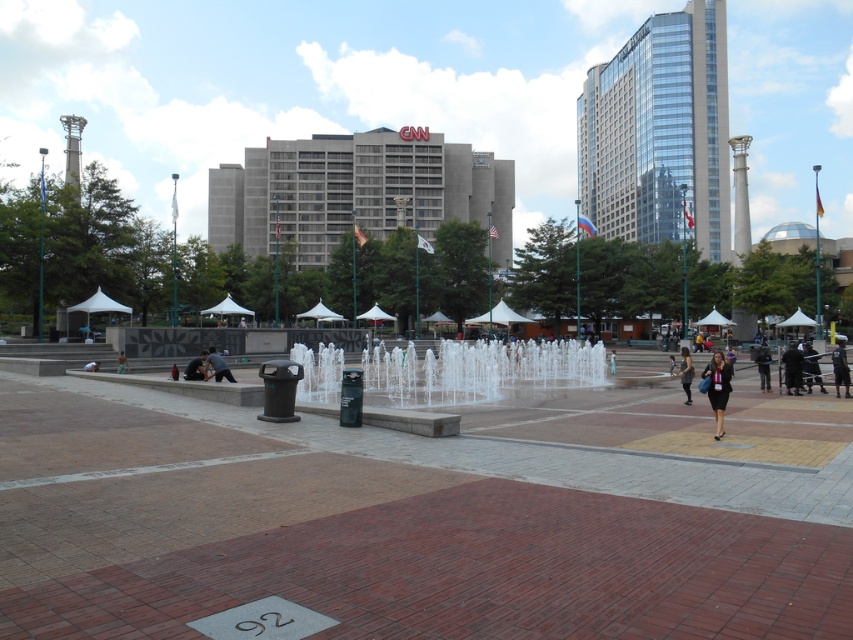
Question: Estimate the real-world distances between objects in this image. Which object is closer to the dark blue jacket at lower right?

Choices:
 (A) dark hair person at center
 (B) dark blue uniform at center
 (C) dark gray jacket at center

Answer: (B)

Question: Which point is farther to the camera?

Choices:
 (A) clear glass water at center
 (B) black leather jacket at lower right

Answer: (B)

Question: Does clear glass water at center have a lesser width compared to black leather jacket at lower right?

Choices:
 (A) yes
 (B) no

Answer: (B)

Question: Does dark gray fabric jacket at lower right have a smaller size compared to dark gray fabric dress at lower right?

Choices:
 (A) no
 (B) yes

Answer: (A)

Question: Is dark blue uniform at center thinner than dark gray jacket at center?

Choices:
 (A) no
 (B) yes

Answer: (A)

Question: Which point appears closest to the camera in this image?

Choices:
 (A) (227, 611)
 (B) (686, 388)
 (C) (221, 362)
 (D) (335, 349)

Answer: (A)